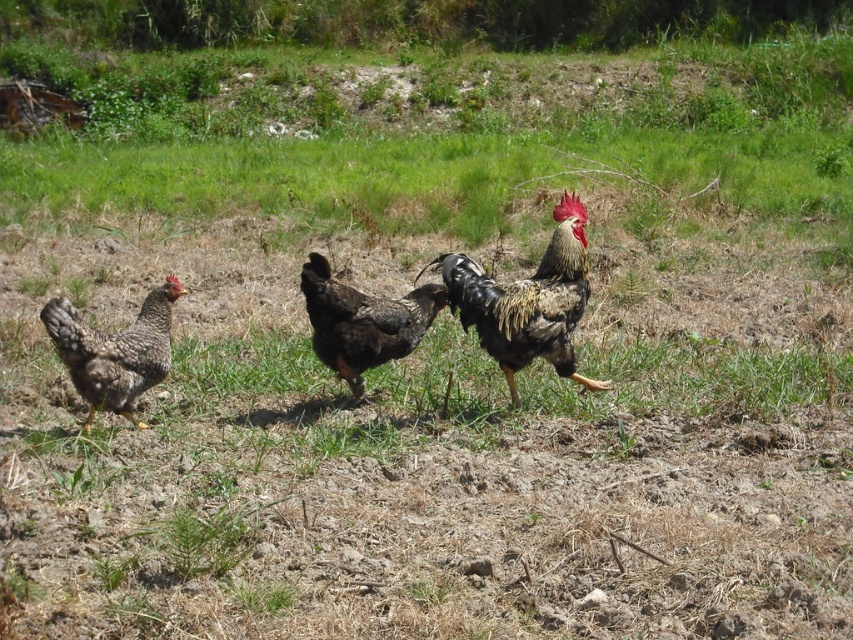
How much distance is there between black glossy rooster at center and speckled feathered chicken at center?

A distance of 17.96 inches exists between black glossy rooster at center and speckled feathered chicken at center.

Is black glossy rooster at center below speckled feathered chicken at center?

Yes.

Between point (573, 252) and point (329, 296), which one is positioned behind?

Positioned behind is point (329, 296).

The height and width of the screenshot is (640, 853). In order to click on black glossy rooster at center in this screenshot , I will do `click(527, 301)`.

Is speckled feathered chicken at left in front of speckled feathered chicken at center?

Yes, it is.

This screenshot has width=853, height=640. What do you see at coordinates (114, 352) in the screenshot?
I see `speckled feathered chicken at left` at bounding box center [114, 352].

This screenshot has width=853, height=640. I want to click on speckled feathered chicken at left, so click(114, 352).

Does black glossy rooster at center have a larger size compared to speckled feathered chicken at left?

Indeed, black glossy rooster at center has a larger size compared to speckled feathered chicken at left.

Is black glossy rooster at center below speckled feathered chicken at left?

No, black glossy rooster at center is not below speckled feathered chicken at left.

Which is behind, point (463, 268) or point (90, 369)?

The point (463, 268) is more distant.

The width and height of the screenshot is (853, 640). Find the location of `black glossy rooster at center`. black glossy rooster at center is located at coordinates (527, 301).